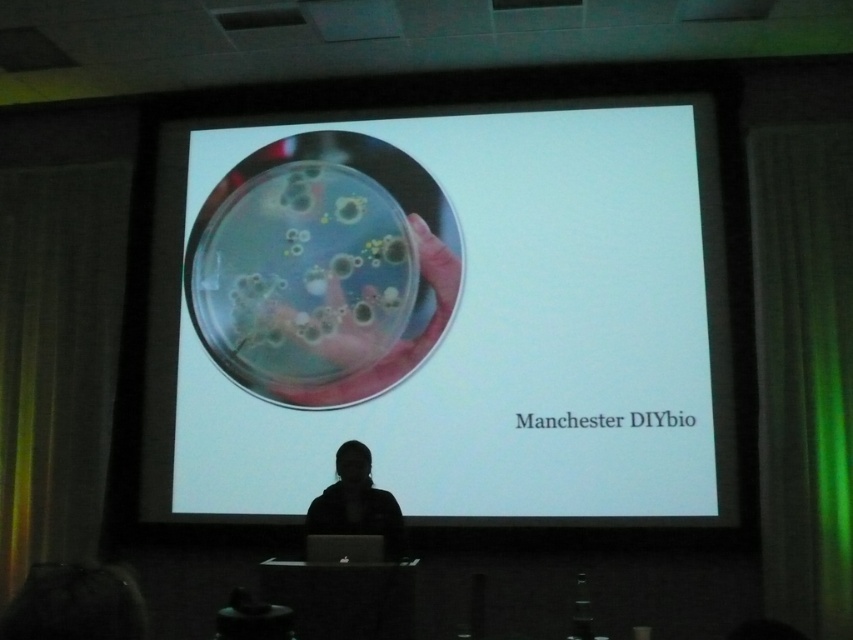
Question: Observing the image, what is the correct spatial positioning of green fabric curtain at right in reference to black matte jacket at lower center?

Choices:
 (A) left
 (B) right

Answer: (B)

Question: Which point is closer to the camera?

Choices:
 (A) black matte jacket at lower center
 (B) green fabric curtain at right

Answer: (A)

Question: Which of the following is the closest to the observer?

Choices:
 (A) black matte jacket at lower center
 (B) green fabric curtain at right

Answer: (A)

Question: Does green fabric curtain at right come behind black matte jacket at lower center?

Choices:
 (A) no
 (B) yes

Answer: (B)

Question: Which point is closer to the camera?

Choices:
 (A) (772, 547)
 (B) (347, 506)

Answer: (B)

Question: Can you confirm if green fabric curtain at right is positioned above black matte jacket at lower center?

Choices:
 (A) yes
 (B) no

Answer: (A)